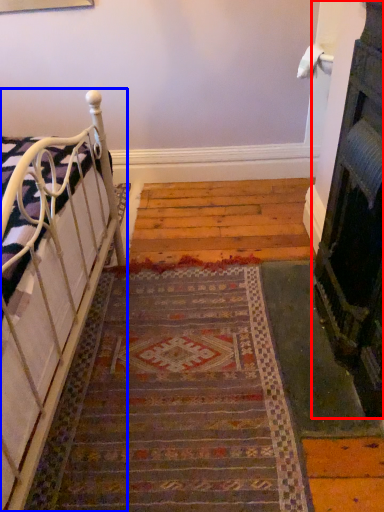
Question: Which of the following is the farthest to the observer, fireplace (highlighted by a red box) or furniture (highlighted by a blue box)?

Choices:
 (A) fireplace
 (B) furniture

Answer: (B)